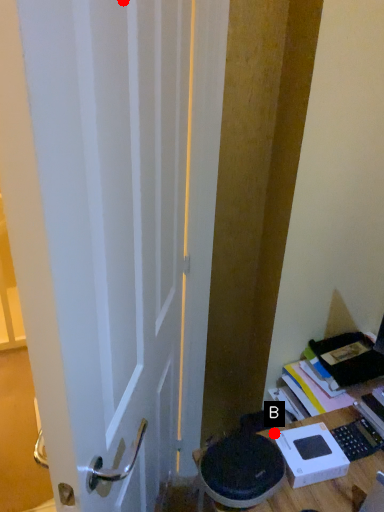
Question: Two points are circled on the image, labeled by A and B beside each circle. Which point is farther to the camera?

Choices:
 (A) A is further
 (B) B is further

Answer: (B)